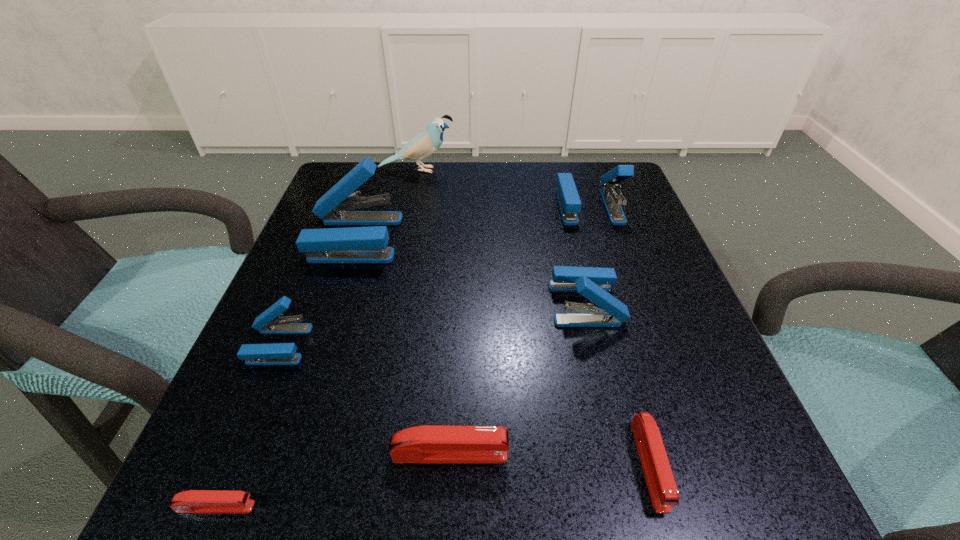
Locate an element on the screen. the farthest object is located at coordinates (427, 142).

Locate an element on the screen. bird is located at coordinates (427, 142).

Locate an element on the screen. the tallest stapler is located at coordinates (354, 244).

I want to click on the third tallest object, so click(569, 201).

The image size is (960, 540). What are the coordinates of `the sixth shortest stapler` in the screenshot? It's located at (569, 201).

This screenshot has height=540, width=960. What are the coordinates of `the third biggest blue stapler` in the screenshot? It's located at (593, 283).

I want to click on the third tallest stapler, so click(593, 283).

At what (x,y) coordinates should I click in order to perform the action: click on the fourth shortest object. Please return your answer as a coordinate pair (x, y). Image resolution: width=960 pixels, height=540 pixels. Looking at the image, I should click on (269, 322).

Locate an element on the screen. The width and height of the screenshot is (960, 540). the fourth tallest stapler is located at coordinates (269, 322).

You are a GUI agent. You are given a task and a screenshot of the screen. Output one action in this format:
    pyautogui.click(x=<x>, y=<y>)
    Task: Click on the third shortest object
    Image resolution: width=960 pixels, height=540 pixels.
    Given the screenshot: What is the action you would take?
    pyautogui.click(x=428, y=443)